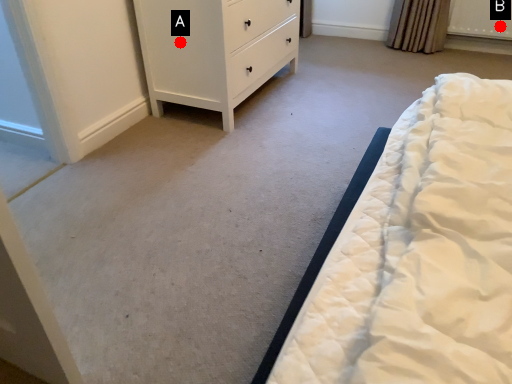
Question: Two points are circled on the image, labeled by A and B beside each circle. Which point is closer to the camera taking this photo?

Choices:
 (A) A is closer
 (B) B is closer

Answer: (A)